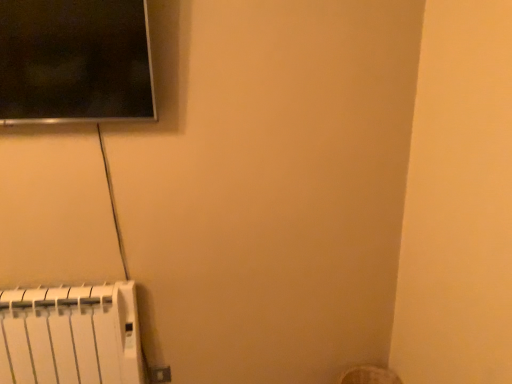
Question: Can you confirm if white plastic radiator at lower left is taller than white plastic electric outlet at lower left?

Choices:
 (A) no
 (B) yes

Answer: (B)

Question: From the image's perspective, is white plastic radiator at lower left located beneath white plastic electric outlet at lower left?

Choices:
 (A) no
 (B) yes

Answer: (A)

Question: Would you consider white plastic radiator at lower left to be distant from white plastic electric outlet at lower left?

Choices:
 (A) yes
 (B) no

Answer: (B)

Question: From the image's perspective, is white plastic radiator at lower left above white plastic electric outlet at lower left?

Choices:
 (A) yes
 (B) no

Answer: (A)

Question: Could you tell me if white plastic radiator at lower left is facing white plastic electric outlet at lower left?

Choices:
 (A) no
 (B) yes

Answer: (A)

Question: From a real-world perspective, is white plastic radiator at lower left positioned under white plastic electric outlet at lower left based on gravity?

Choices:
 (A) no
 (B) yes

Answer: (A)

Question: From a real-world perspective, is white plastic electric outlet at lower left physically above white plastic radiator at lower left?

Choices:
 (A) yes
 (B) no

Answer: (B)

Question: Does white plastic electric outlet at lower left turn towards white plastic radiator at lower left?

Choices:
 (A) no
 (B) yes

Answer: (A)

Question: Can you confirm if white plastic electric outlet at lower left is smaller than white plastic radiator at lower left?

Choices:
 (A) no
 (B) yes

Answer: (B)

Question: Is white plastic radiator at lower left a part of white plastic electric outlet at lower left?

Choices:
 (A) no
 (B) yes

Answer: (A)

Question: From the image's perspective, is white plastic electric outlet at lower left over white plastic radiator at lower left?

Choices:
 (A) yes
 (B) no

Answer: (B)

Question: Is white plastic electric outlet at lower left closer to the viewer compared to white plastic radiator at lower left?

Choices:
 (A) yes
 (B) no

Answer: (B)

Question: Relative to white plastic radiator at lower left, is white plastic electric outlet at lower left in front or behind?

Choices:
 (A) behind
 (B) front

Answer: (A)